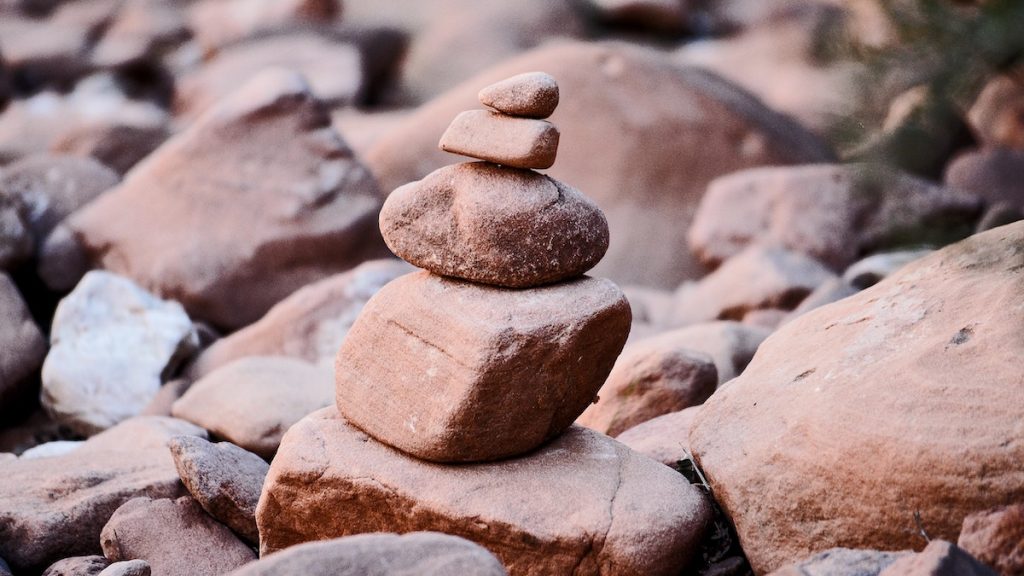
The height and width of the screenshot is (576, 1024). What are the coordinates of `corner` in the screenshot? It's located at (1004, 555), (16, 560), (34, 34), (990, 20).